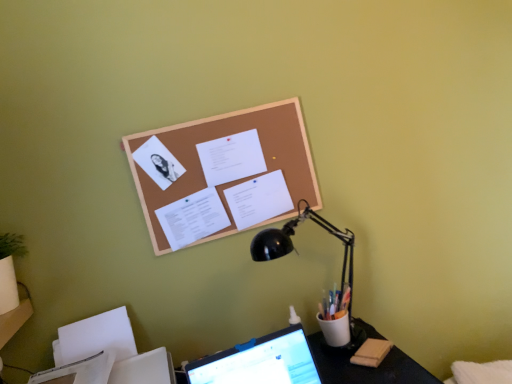
Question: Is the position of white paper at center, positioned as the second document in bottom-to-top order, more distant than that of white paper at center, the 1th document when ordered from bottom to top?

Choices:
 (A) yes
 (B) no

Answer: (A)

Question: Is white paper at center, positioned as the second document in bottom-to-top order, looking in the opposite direction of white paper at center, the 1th document when ordered from bottom to top?

Choices:
 (A) no
 (B) yes

Answer: (A)

Question: Does white paper at center, positioned as the second document in bottom-to-top order, have a lesser height compared to white paper at center, the 1th document when ordered from bottom to top?

Choices:
 (A) no
 (B) yes

Answer: (A)

Question: From a real-world perspective, does white paper at center, positioned as the second document in bottom-to-top order, stand above white paper at center, which ranks as the third document in top-to-bottom order?

Choices:
 (A) no
 (B) yes

Answer: (B)

Question: From the image's perspective, is white paper at center, marked as the 2th document in a top-to-bottom arrangement, on white paper at center, which ranks as the third document in top-to-bottom order?

Choices:
 (A) no
 (B) yes

Answer: (B)

Question: Is white paper at center, marked as the 2th document in a top-to-bottom arrangement, directly adjacent to white paper at center, the 1th document when ordered from bottom to top?

Choices:
 (A) yes
 (B) no

Answer: (B)

Question: Is corkboard at upper center thinner than white paper at center, marked as the 2th document in a top-to-bottom arrangement?

Choices:
 (A) no
 (B) yes

Answer: (B)

Question: Is corkboard at upper center oriented towards white paper at center, marked as the 2th document in a top-to-bottom arrangement?

Choices:
 (A) no
 (B) yes

Answer: (B)

Question: Is corkboard at upper center located outside white paper at center, marked as the 2th document in a top-to-bottom arrangement?

Choices:
 (A) yes
 (B) no

Answer: (A)

Question: Is corkboard at upper center taller than white paper at center, positioned as the second document in bottom-to-top order?

Choices:
 (A) no
 (B) yes

Answer: (B)

Question: Can you confirm if corkboard at upper center is smaller than white paper at center, marked as the 2th document in a top-to-bottom arrangement?

Choices:
 (A) no
 (B) yes

Answer: (A)

Question: From a real-world perspective, does corkboard at upper center stand above white paper at center, positioned as the second document in bottom-to-top order?

Choices:
 (A) yes
 (B) no

Answer: (A)

Question: Is white paper at center, marked as the 2th document in a top-to-bottom arrangement, placed right next to corkboard at upper center?

Choices:
 (A) yes
 (B) no

Answer: (B)